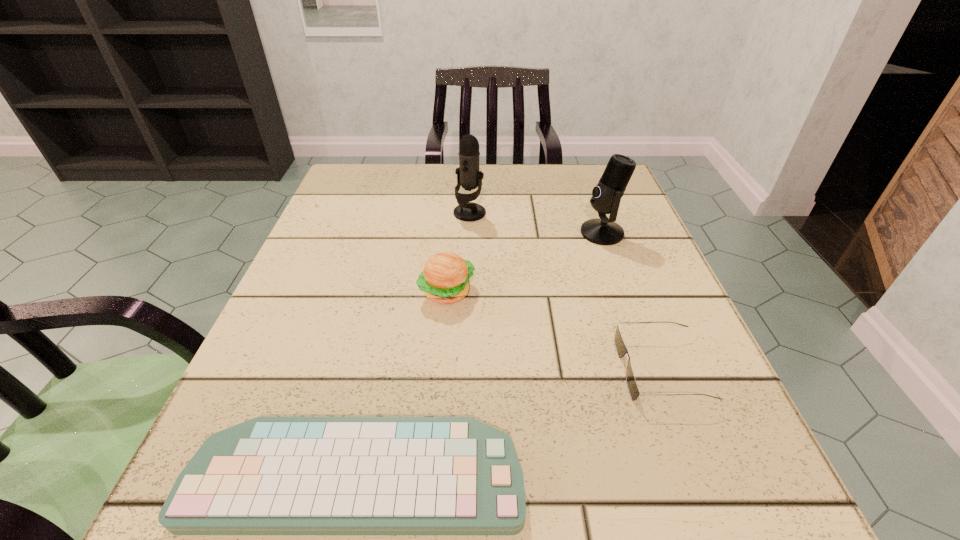
Identify the location of free space between the left microphone and the right microphone. (536, 223).

Find the location of a particular element. The height and width of the screenshot is (540, 960). vacant area that lies between the nearest object and the left microphone is located at coordinates (413, 345).

Where is `empty space between the left microphone and the second shortest object`? The width and height of the screenshot is (960, 540). empty space between the left microphone and the second shortest object is located at coordinates (565, 292).

I want to click on vacant space that is in between the third shortest object and the computer keyboard, so click(402, 384).

Find the location of a particular element. The image size is (960, 540). free spot between the right microphone and the third nearest object is located at coordinates (524, 262).

Locate an element on the screen. The height and width of the screenshot is (540, 960). vacant space in between the left microphone and the second nearest object is located at coordinates (565, 292).

Locate an element on the screen. free space between the left microphone and the right microphone is located at coordinates (536, 223).

Find the location of a particular element. The image size is (960, 540). free space between the second shortest object and the third farthest object is located at coordinates pos(554,330).

Find the location of a particular element. empty space that is in between the second nearest object and the shortest object is located at coordinates (509, 423).

Identify the location of the second closest object to the sunglasses. (445, 278).